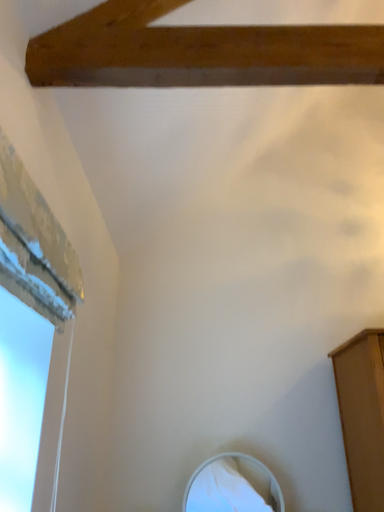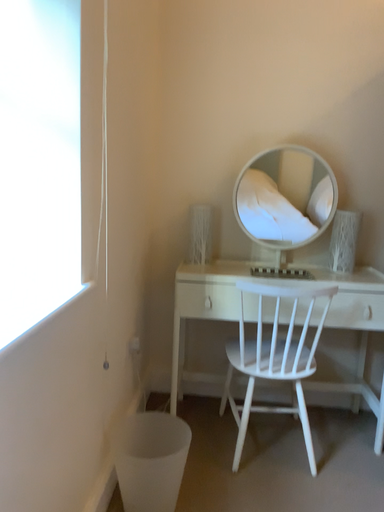
Question: Which way did the camera rotate in the video?

Choices:
 (A) rotated downward
 (B) rotated upward

Answer: (A)